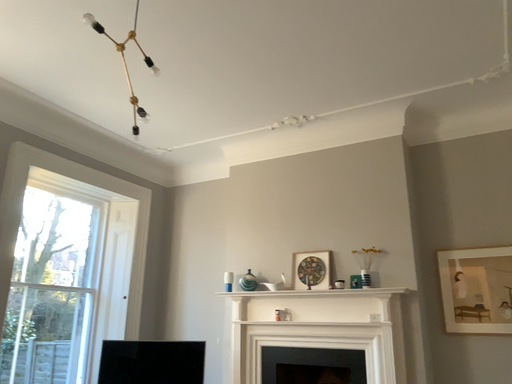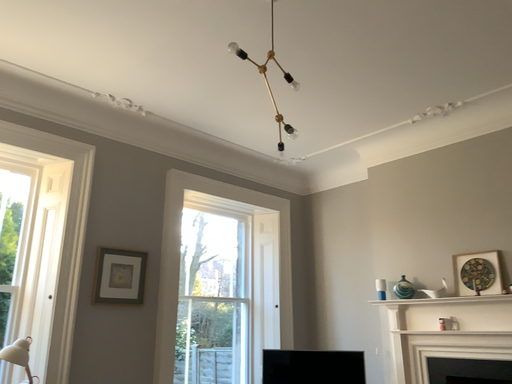
Question: Which way did the camera rotate in the video?

Choices:
 (A) rotated right
 (B) rotated left

Answer: (B)